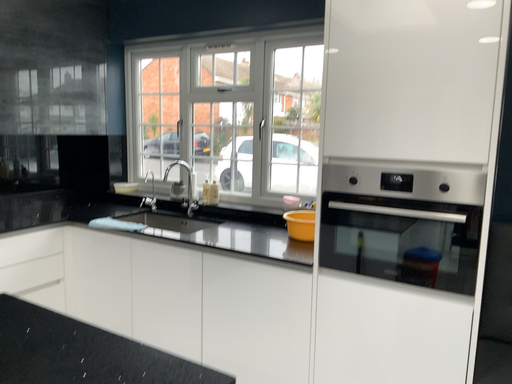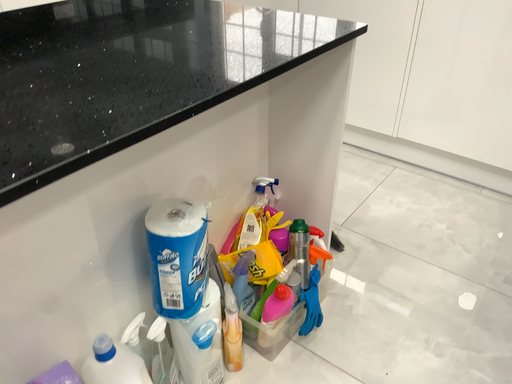
Question: How did the camera likely rotate when shooting the video?

Choices:
 (A) rotated right
 (B) rotated left

Answer: (B)